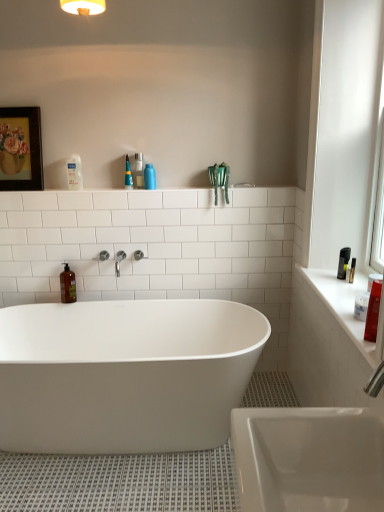
Locate an element on the screen. Image resolution: width=384 pixels, height=512 pixels. vacant space positioned to the left of clear plastic bottle at upper left, which is the second toiletry from right to left is located at coordinates (57, 189).